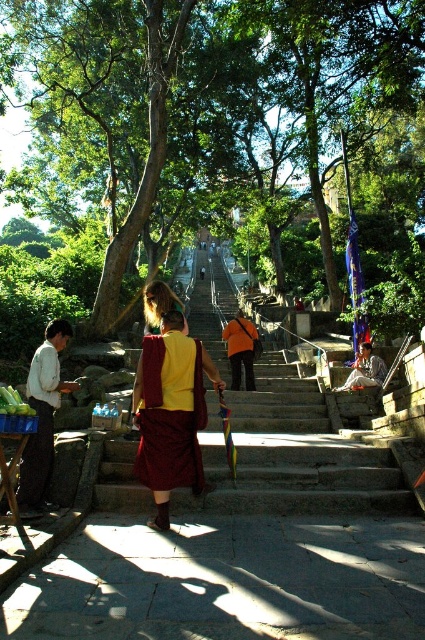
Question: Based on their relative distances, which object is farther from the maroon silk robe at center?

Choices:
 (A) maroon silk robe at left
 (B) stone stairs at center

Answer: (B)

Question: Does stone stairs at center appear on the left side of maroon silk robe at center?

Choices:
 (A) no
 (B) yes

Answer: (A)

Question: Estimate the real-world distances between objects in this image. Which object is farther from the maroon silk robe at left?

Choices:
 (A) maroon silk robe at center
 (B) orange fabric robe at center
 (C) stone stairs at center

Answer: (B)

Question: In this image, where is stone stairs at center located relative to light brown wooden bench at center?

Choices:
 (A) left
 (B) right

Answer: (A)

Question: Which of the following is the closest to the observer?

Choices:
 (A) (180, 348)
 (B) (387, 369)
 (C) (44, 438)

Answer: (A)

Question: Does maroon silk robe at left appear on the left side of blonde hair at center?

Choices:
 (A) no
 (B) yes

Answer: (B)